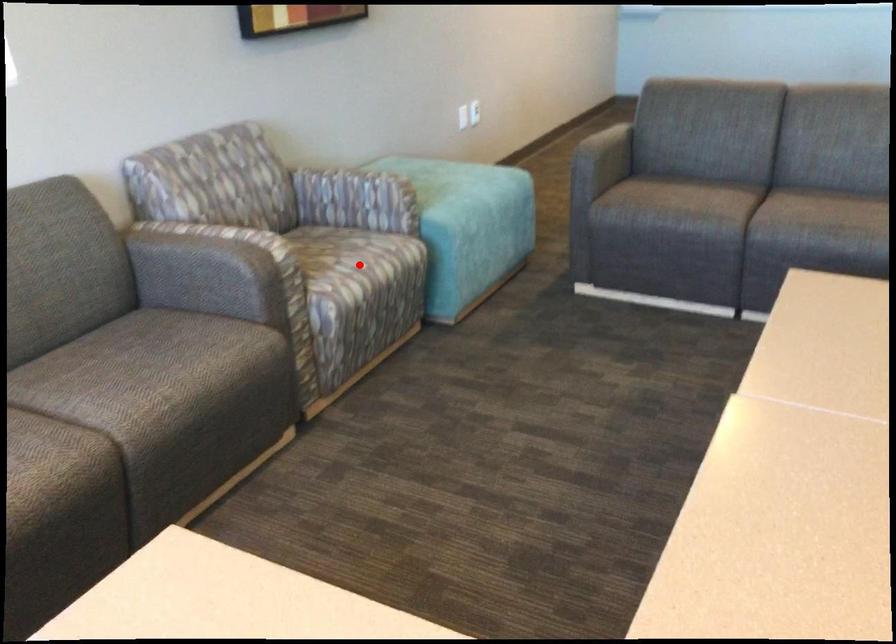
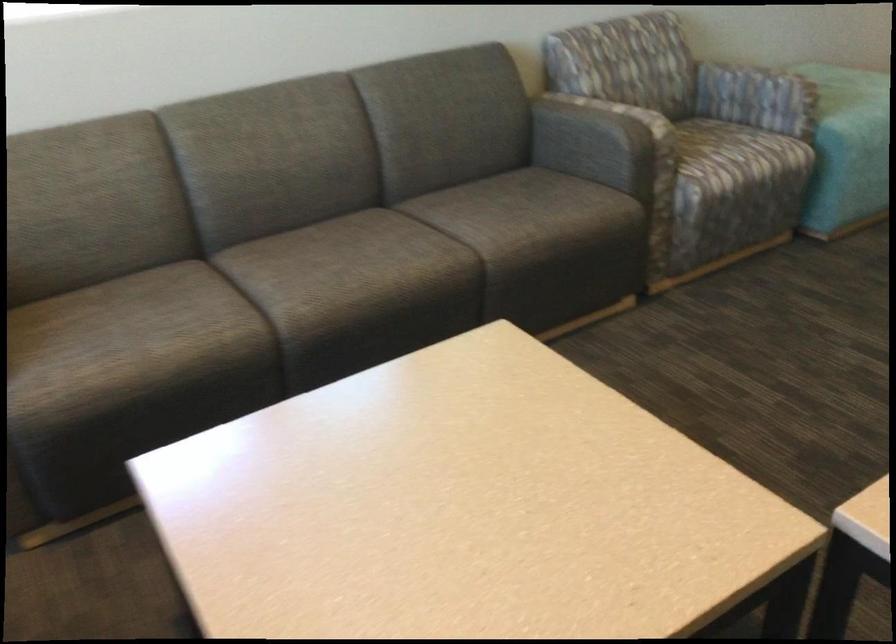
The point at the highlighted location is marked in the first image. Where is the corresponding point in the second image?

(737, 155)